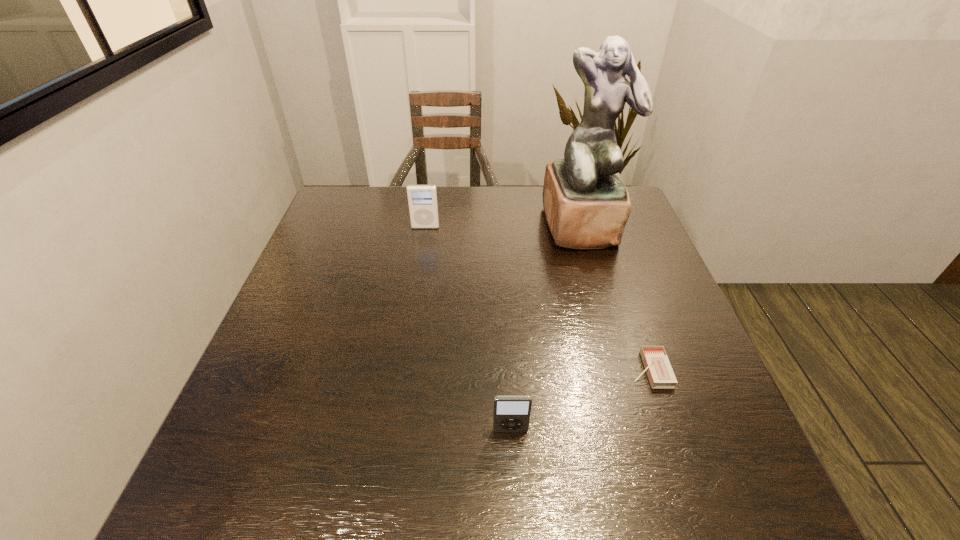
This screenshot has height=540, width=960. Identify the location of sculpture. (586, 204).

Find the location of a particular element. This screenshot has height=540, width=960. the leftmost object is located at coordinates (422, 199).

Where is `the left iPod`? Image resolution: width=960 pixels, height=540 pixels. the left iPod is located at coordinates (422, 199).

The width and height of the screenshot is (960, 540). I want to click on the right iPod, so click(511, 413).

Find the location of `the nearest object`. the nearest object is located at coordinates [511, 413].

Find the location of a particular element. the third farthest object is located at coordinates (660, 373).

You are a GUI agent. You are given a task and a screenshot of the screen. Output one action in this format:
    pyautogui.click(x=<x>, y=<y>)
    Task: Click on the matchbox
    The image size is (960, 540).
    Given the screenshot: What is the action you would take?
    pyautogui.click(x=660, y=373)

Identify the location of free point located 0.320m in a relaxed pose on the tallest object. (617, 343).

Identify the location of blank space located on the front-facing side of the farther iPod. tap(416, 288).

Locate an element on the screen. The height and width of the screenshot is (540, 960). free spot located 0.100m on the front-facing side of the right iPod is located at coordinates (514, 489).